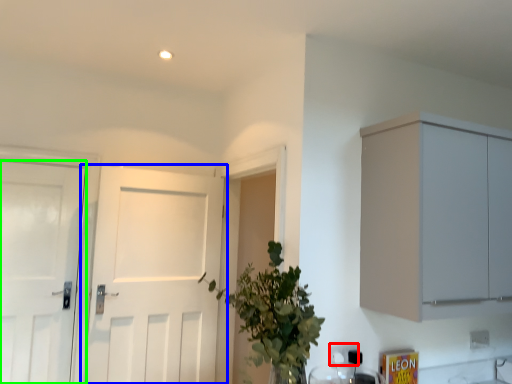
Question: Which object is positioned farthest from electric outlet (highlighted by a red box)? Select from door (highlighted by a blue box) and door (highlighted by a green box).

Choices:
 (A) door
 (B) door

Answer: (B)